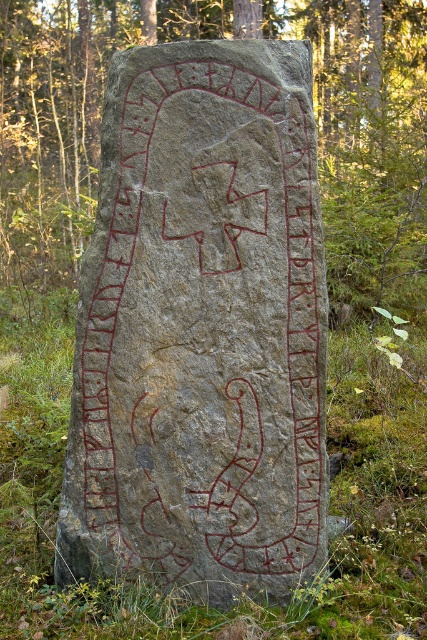
Can you confirm if gray stone at center is positioned above gray stone carving at center?

No, gray stone at center is not above gray stone carving at center.

Which of these two, gray stone at center or gray stone carving at center, stands taller?

Standing taller between the two is gray stone carving at center.

Is point (158, 145) positioned before point (400, 243)?

Yes.

The image size is (427, 640). Identify the location of gray stone at center. (201, 326).